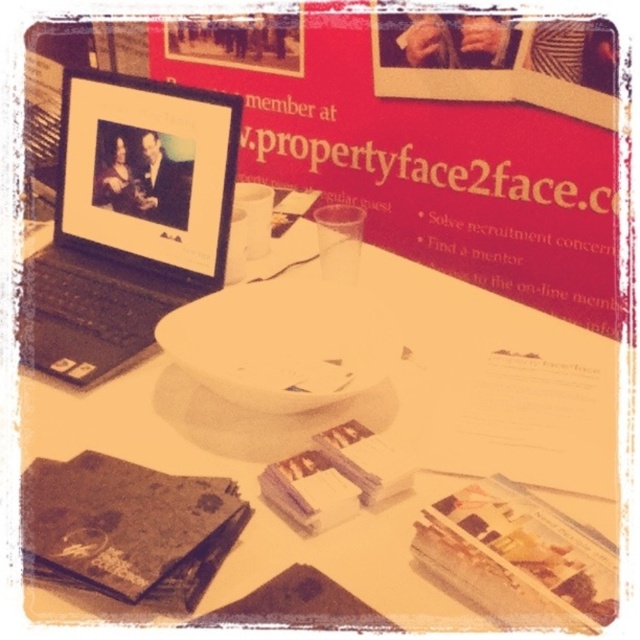
Question: Can you confirm if white glossy plate at upper center is smaller than matte brown book at center?

Choices:
 (A) yes
 (B) no

Answer: (B)

Question: Among these objects, which one is nearest to the camera?

Choices:
 (A) dark brown textured book at lower left
 (B) white matte saucer at center

Answer: (A)

Question: Among these points, which one is farthest from the camera?

Choices:
 (A) (442, 536)
 (B) (202, 132)
 (C) (275, 486)
 (D) (330, 310)

Answer: (B)

Question: Which object is positioned farthest from the matte black laptop at left?

Choices:
 (A) matte paper book at center
 (B) dark brown textured book at lower left

Answer: (A)

Question: Considering the relative positions of matte paper book at center and matte brown book at center in the image provided, where is matte paper book at center located with respect to matte brown book at center?

Choices:
 (A) right
 (B) left

Answer: (A)

Question: Is matte black laptop at left smaller than white matte saucer at center?

Choices:
 (A) no
 (B) yes

Answer: (A)